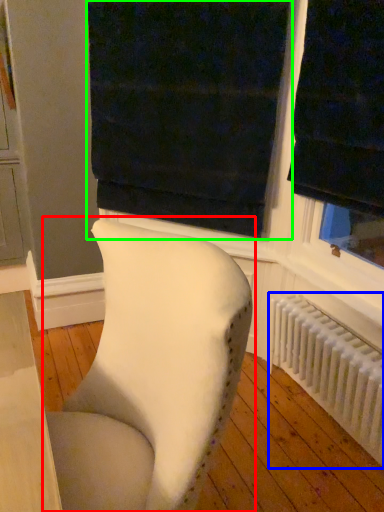
Question: Which object is the farthest from chair (highlighted by a red box)? Choose among these: radiator (highlighted by a blue box) or curtain (highlighted by a green box).

Choices:
 (A) radiator
 (B) curtain

Answer: (B)